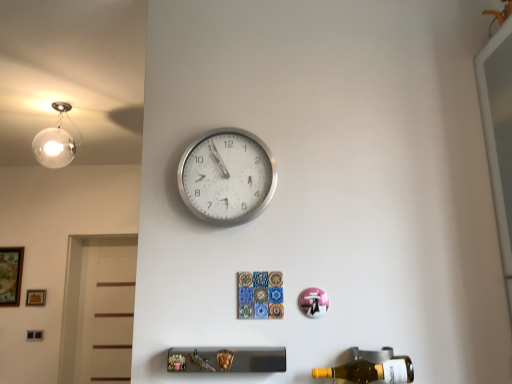
Question: Should I look upward or downward to see wooden picture frame at lower left, which is the 2th picture frame from left to right?

Choices:
 (A) down
 (B) up

Answer: (A)

Question: From a real-world perspective, is silver metallic wall clock at upper center beneath yellow glass bottle at lower right?

Choices:
 (A) yes
 (B) no

Answer: (B)

Question: Is the position of silver metallic wall clock at upper center more distant than that of yellow glass bottle at lower right?

Choices:
 (A) no
 (B) yes

Answer: (B)

Question: Does silver metallic wall clock at upper center have a greater width compared to yellow glass bottle at lower right?

Choices:
 (A) yes
 (B) no

Answer: (B)

Question: From the image's perspective, is silver metallic wall clock at upper center above yellow glass bottle at lower right?

Choices:
 (A) yes
 (B) no

Answer: (A)

Question: Is silver metallic wall clock at upper center completely or partially outside of yellow glass bottle at lower right?

Choices:
 (A) no
 (B) yes

Answer: (B)

Question: From a real-world perspective, is silver metallic wall clock at upper center on yellow glass bottle at lower right?

Choices:
 (A) yes
 (B) no

Answer: (A)

Question: Is yellow glass bottle at lower right thinner than wooden framed artwork at left, which ranks as the 2th picture frame in right-to-left order?

Choices:
 (A) yes
 (B) no

Answer: (B)

Question: From the image's perspective, does yellow glass bottle at lower right appear higher than wooden framed artwork at left, which ranks as the 2th picture frame in right-to-left order?

Choices:
 (A) yes
 (B) no

Answer: (A)

Question: Can you confirm if yellow glass bottle at lower right is bigger than wooden framed artwork at left, the first picture frame from the left?

Choices:
 (A) no
 (B) yes

Answer: (B)

Question: Can you see yellow glass bottle at lower right touching wooden framed artwork at left, which ranks as the 2th picture frame in right-to-left order?

Choices:
 (A) yes
 (B) no

Answer: (B)

Question: From the image's perspective, would you say yellow glass bottle at lower right is shown under wooden framed artwork at left, which ranks as the 2th picture frame in right-to-left order?

Choices:
 (A) no
 (B) yes

Answer: (A)

Question: Considering the relative positions of yellow glass bottle at lower right and wooden framed artwork at left, which ranks as the 2th picture frame in right-to-left order, in the image provided, is yellow glass bottle at lower right to the left of wooden framed artwork at left, which ranks as the 2th picture frame in right-to-left order, from the viewer's perspective?

Choices:
 (A) no
 (B) yes

Answer: (A)

Question: Considering the relative positions of wooden framed artwork at left, the first picture frame from the left, and yellow glass bottle at lower right in the image provided, is wooden framed artwork at left, the first picture frame from the left, behind yellow glass bottle at lower right?

Choices:
 (A) yes
 (B) no

Answer: (A)